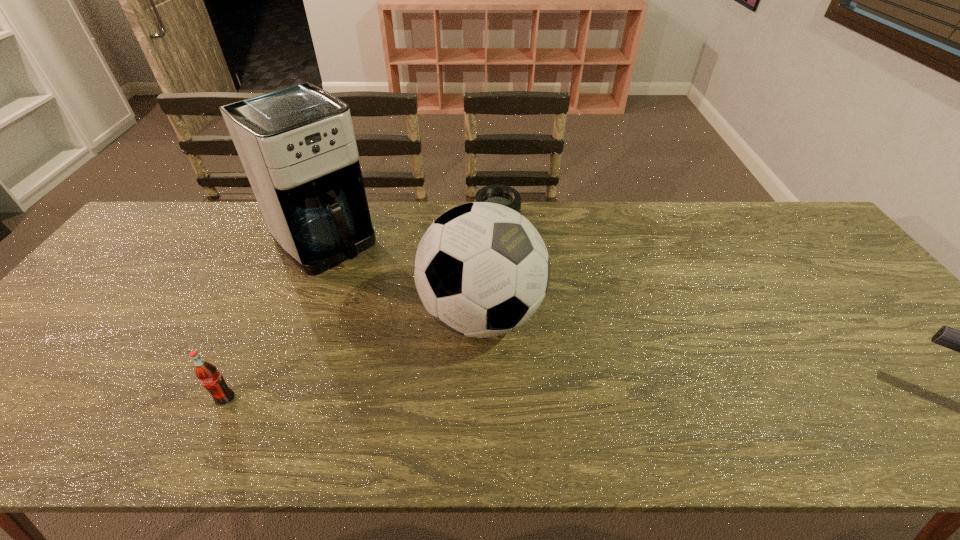
Where is `free space on the desktop that is between the soda bottle and the rightmost object and is positioned on the side of the telephoto lens with brand markings and control switches`? The width and height of the screenshot is (960, 540). free space on the desktop that is between the soda bottle and the rightmost object and is positioned on the side of the telephoto lens with brand markings and control switches is located at coordinates (513, 400).

Where is `free space on the desktop that is between the soda bottle and the gun and is positioned on the main logo of the fourth shortest object`? free space on the desktop that is between the soda bottle and the gun and is positioned on the main logo of the fourth shortest object is located at coordinates (628, 401).

The width and height of the screenshot is (960, 540). In order to click on vacant space on the desktop that is between the soda bottle and the rightmost object and is positioned on the front panel of the coffee maker in this screenshot , I will do `click(502, 400)`.